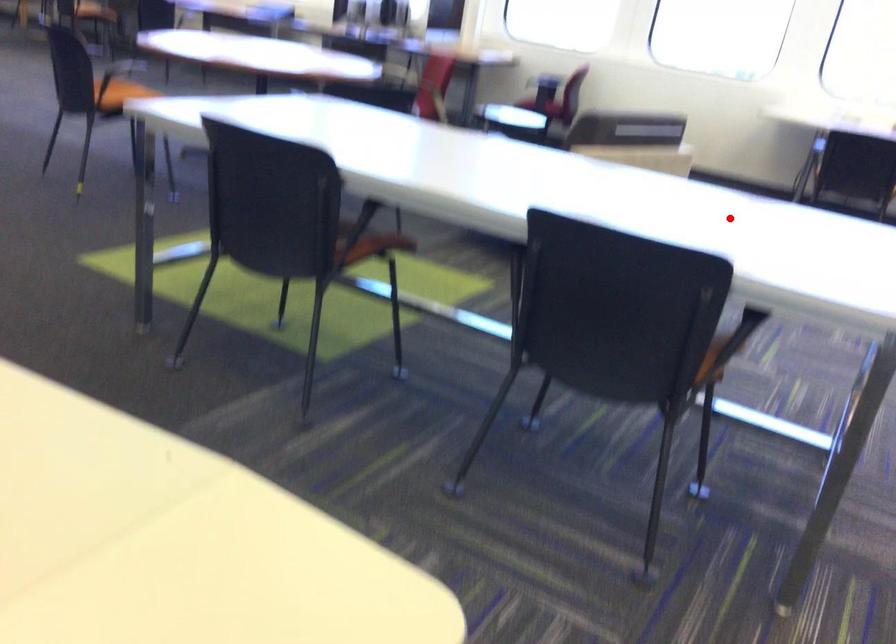
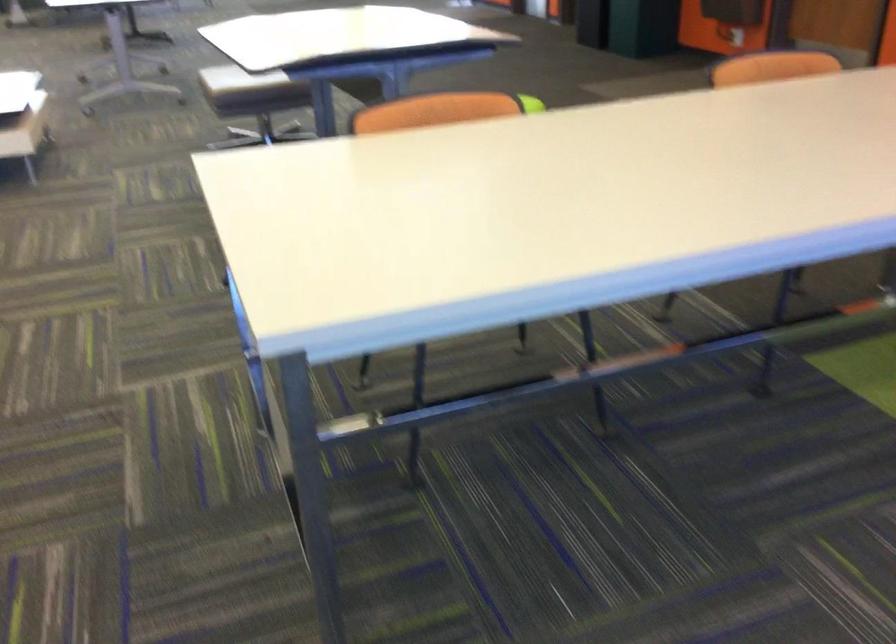
Where in the second image is the point corresponding to the highlighted location from the first image?

(492, 189)